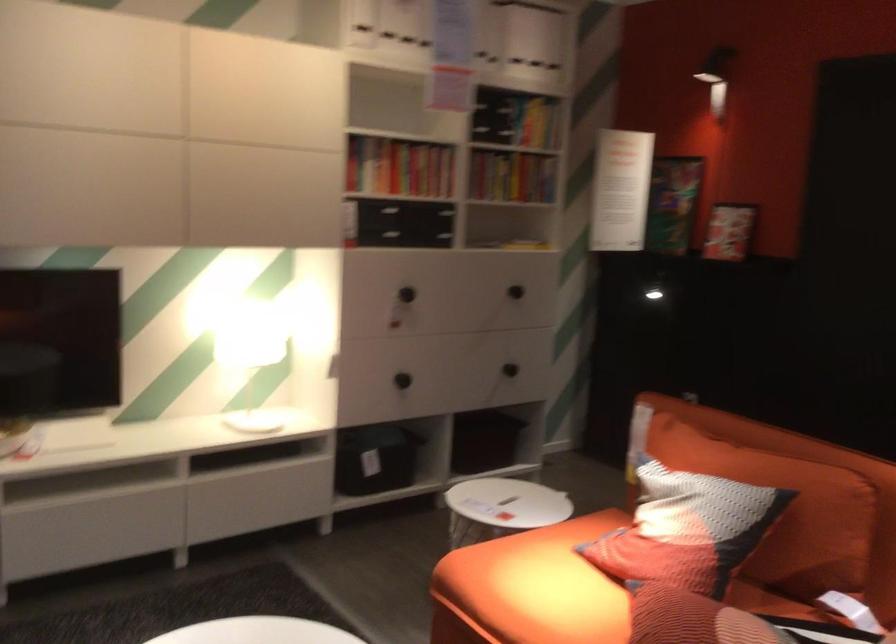
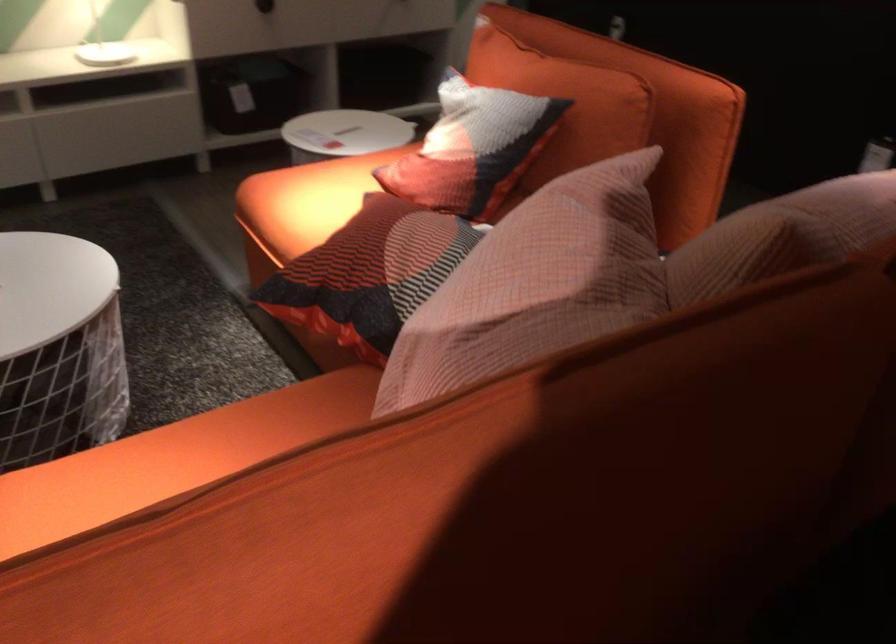
Where in the second image is the point corresponding to the point at 705,529 from the first image?

(472, 147)